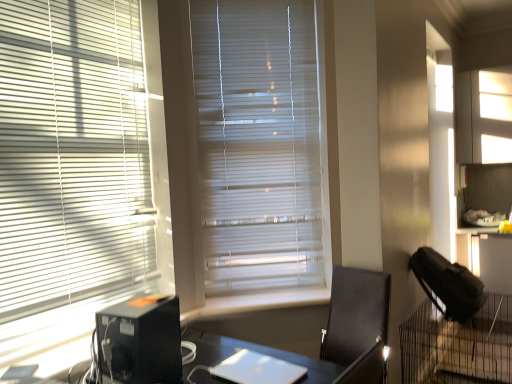
Question: Can you confirm if black plastic computer tower at lower left is taller than white matte blinds at left, the 1th window blind when ordered from left to right?

Choices:
 (A) yes
 (B) no

Answer: (B)

Question: Is black plastic computer tower at lower left aimed at white matte blinds at left, acting as the 1th window blind starting from the front?

Choices:
 (A) no
 (B) yes

Answer: (A)

Question: From the image's perspective, is black plastic computer tower at lower left on top of white matte blinds at left, the 1th window blind when ordered from left to right?

Choices:
 (A) no
 (B) yes

Answer: (A)

Question: From the image's perspective, is black plastic computer tower at lower left located beneath white matte blinds at left, the 1th window blind when ordered from left to right?

Choices:
 (A) yes
 (B) no

Answer: (A)

Question: Is black plastic computer tower at lower left to the right of white matte blinds at left, the 1th window blind when ordered from left to right, from the viewer's perspective?

Choices:
 (A) no
 (B) yes

Answer: (B)

Question: From the image's perspective, is white matte blinds at left, the 1th window blind when ordered from left to right, above or below white smooth window sill at center?

Choices:
 (A) above
 (B) below

Answer: (A)

Question: Is white matte blinds at left, the 1th window blind when ordered from left to right, in front of or behind white smooth window sill at center in the image?

Choices:
 (A) behind
 (B) front

Answer: (B)

Question: Does point (98, 286) appear closer or farther from the camera than point (241, 297)?

Choices:
 (A) farther
 (B) closer

Answer: (B)

Question: Visually, is white matte blinds at left, marked as the 2th window blind in a right-to-left arrangement, positioned to the left or to the right of white smooth window sill at center?

Choices:
 (A) right
 (B) left

Answer: (B)

Question: Looking at their shapes, would you say silver metallic laptop at center is wider or thinner than white matte blinds at left, the 1th window blind when ordered from left to right?

Choices:
 (A) wide
 (B) thin

Answer: (A)

Question: In the image, is silver metallic laptop at center positioned in front of or behind white matte blinds at left, the 1th window blind when ordered from left to right?

Choices:
 (A) front
 (B) behind

Answer: (A)

Question: Visually, is silver metallic laptop at center positioned to the left or to the right of white matte blinds at left, acting as the 2th window blind starting from the back?

Choices:
 (A) right
 (B) left

Answer: (A)

Question: Is silver metallic laptop at center taller or shorter than white matte blinds at left, acting as the 2th window blind starting from the back?

Choices:
 (A) short
 (B) tall

Answer: (A)

Question: In terms of height, does black plastic computer tower at lower left look taller or shorter compared to silver metallic laptop at center?

Choices:
 (A) tall
 (B) short

Answer: (A)

Question: Is black plastic computer tower at lower left wider or thinner than silver metallic laptop at center?

Choices:
 (A) wide
 (B) thin

Answer: (B)